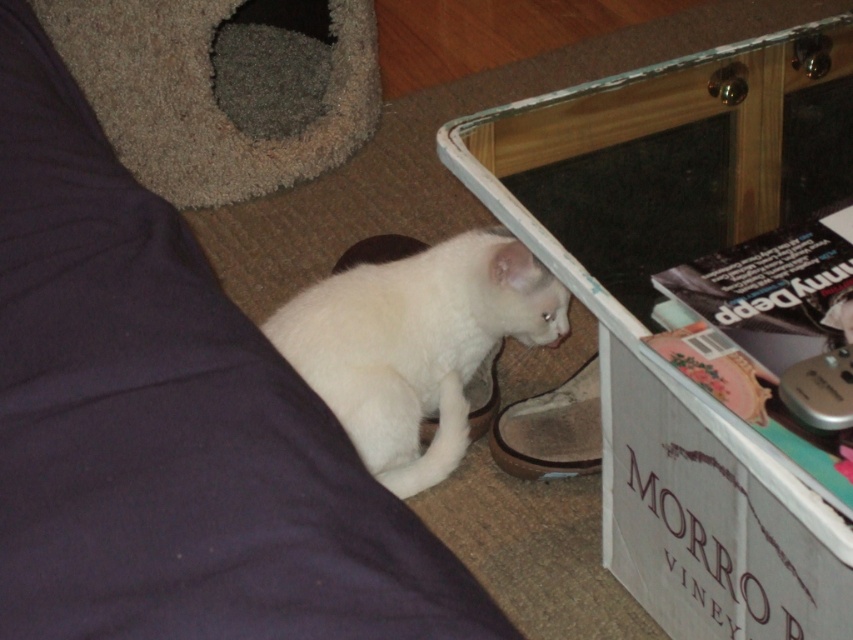
Does point (709, 556) come closer to viewer compared to point (462, 365)?

Yes, point (709, 556) is closer to viewer.

Is transparent glass table at lower right wider than white fluffy cat at lower center?

Yes, transparent glass table at lower right is wider than white fluffy cat at lower center.

Describe the element at coordinates (647, 332) in the screenshot. The width and height of the screenshot is (853, 640). I see `transparent glass table at lower right` at that location.

Image resolution: width=853 pixels, height=640 pixels. I want to click on transparent glass table at lower right, so click(647, 332).

Who is positioned more to the right, transparent glass table at lower right or white cardboard box at lower right?

transparent glass table at lower right is more to the right.

Between point (776, 61) and point (630, 445), which one is positioned in front?

Point (630, 445)

Is point (795, 72) positioned before point (648, 413)?

No.

At what (x,y) coordinates should I click in order to perform the action: click on transparent glass table at lower right. Please return your answer as a coordinate pair (x, y). This screenshot has height=640, width=853. Looking at the image, I should click on (647, 332).

Can you confirm if white cardboard box at lower right is smaller than white fluffy cat at lower center?

No, white cardboard box at lower right is not smaller than white fluffy cat at lower center.

Can you confirm if white cardboard box at lower right is bigger than white fluffy cat at lower center?

Correct, white cardboard box at lower right is larger in size than white fluffy cat at lower center.

Is point (827, 554) farther from camera compared to point (413, 417)?

No, (827, 554) is in front of (413, 417).

Where is `white cardboard box at lower right`? This screenshot has width=853, height=640. white cardboard box at lower right is located at coordinates (711, 515).